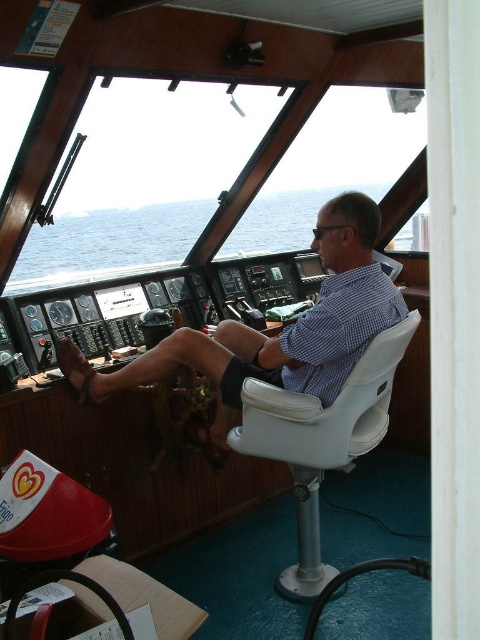
Does blue water at center have a greater height compared to white plastic chair at center?

In fact, blue water at center may be shorter than white plastic chair at center.

Does blue water at center have a greater width compared to white plastic chair at center?

Yes, blue water at center is wider than white plastic chair at center.

Measure the distance between blue water at center and camera.

blue water at center and camera are 18.84 feet apart from each other.

Image resolution: width=480 pixels, height=640 pixels. In order to click on blue water at center in this screenshot , I will do `click(107, 244)`.

Can you confirm if matte blue shirt at center is taller than blue water at center?

Indeed, matte blue shirt at center has a greater height compared to blue water at center.

Does matte blue shirt at center have a lesser height compared to blue water at center?

In fact, matte blue shirt at center may be taller than blue water at center.

Between point (226, 428) and point (132, 269), which one is positioned behind?

Point (132, 269)

Where is `matte blue shirt at center`? matte blue shirt at center is located at coordinates (280, 332).

Is point (230, 420) positioned behind point (340, 285)?

Yes, point (230, 420) is behind point (340, 285).

Where is `matte blue shirt at center`? Image resolution: width=480 pixels, height=640 pixels. matte blue shirt at center is located at coordinates (280, 332).

The width and height of the screenshot is (480, 640). I want to click on matte blue shirt at center, so tap(280, 332).